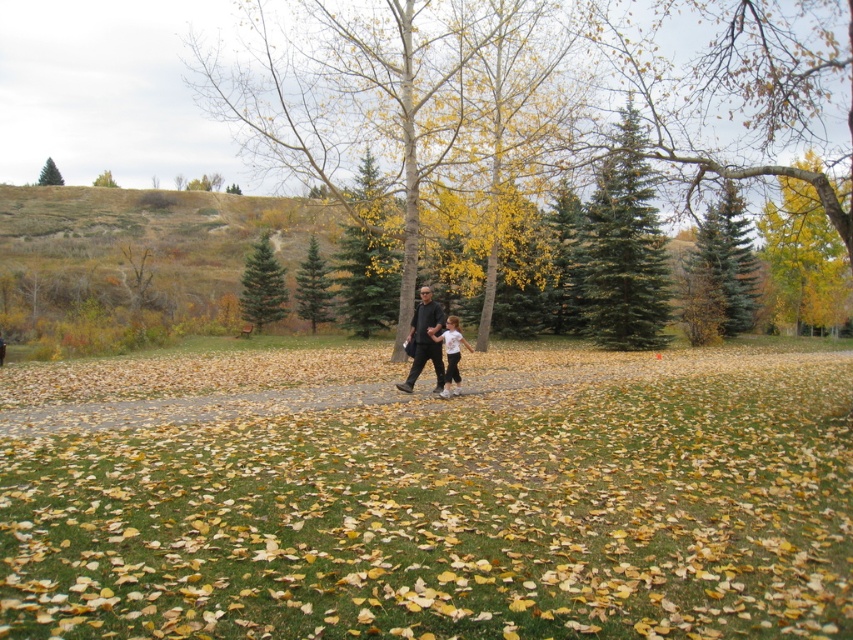
You are a hiker trying to navigate through the autumn park scene. You see the green matte tree at upper left and the green leafy tree at upper center. Which tree is positioned higher up in the image?

The green matte tree at upper left is located above the green leafy tree at upper center, so it is positioned higher up in the image.

You are an arborist assessing the trees in the park. You need to identify which tree is taller between the green matte tree at upper left and the green leafy tree at upper center. Which one should you report as taller?

The green matte tree at upper left is taller than the green leafy tree at upper center according to the description.